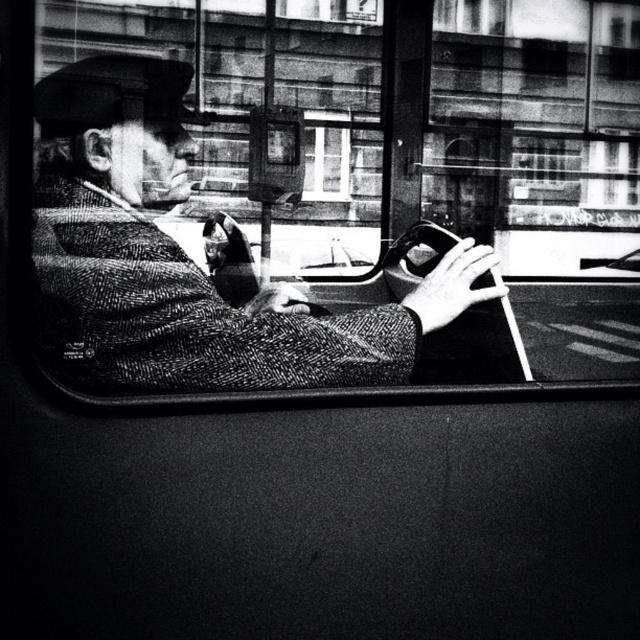
You are a tailor inside the vehicle and need to measure the herringbone wool coat at center and the transparent glass window at center. Which object is bigger in size?

The herringbone wool coat at center is larger in size compared to the transparent glass window at center according to the description.

You are a tailor inside the vehicle and want to measure the herringbone wool coat at center to see if it can be folded and stored under the transparent glass window at center. Based on their heights, can the coat be stored there?

The herringbone wool coat at center is much taller than the transparent glass window at center, so it cannot be stored under the transparent glass window at center without folding or adjusting its height.

You are inside a vehicle and looking out through the window. There is a point marked at coordinates (186, 260). What object is located at that point?

The point at coordinates (186, 260) corresponds to the herringbone wool coat at center.